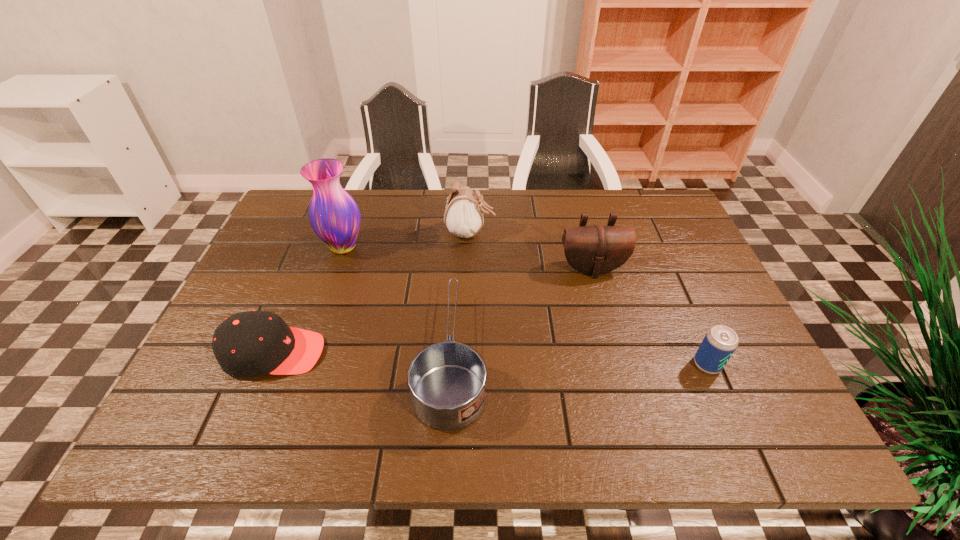
Identify the location of vacant area situated 0.130m on the front-facing side of the cap. The width and height of the screenshot is (960, 540). (383, 353).

You are a GUI agent. You are given a task and a screenshot of the screen. Output one action in this format:
    pyautogui.click(x=<x>, y=<y>)
    Task: Click on the free location located 0.300m on the back of the beer can
    The height and width of the screenshot is (540, 960).
    Given the screenshot: What is the action you would take?
    pyautogui.click(x=661, y=262)

Locate an element on the screen. The width and height of the screenshot is (960, 540). vacant position located 0.370m with the handle extending from one side of the saucepan is located at coordinates pyautogui.click(x=460, y=210).

What are the coordinates of `vacant area situated 0.380m with the handle extending from one side of the saucepan` in the screenshot? It's located at (460, 208).

Find the location of a particular element. The height and width of the screenshot is (540, 960). free space located with the handle extending from one side of the saucepan is located at coordinates (460, 214).

Find the location of a particular element. vase located in the far edge section of the desktop is located at coordinates (334, 216).

The width and height of the screenshot is (960, 540). I want to click on pouch at the far edge, so click(463, 217).

The width and height of the screenshot is (960, 540). I want to click on object that is at the near edge, so click(x=447, y=381).

This screenshot has height=540, width=960. In order to click on vase present at the left edge in this screenshot , I will do `click(334, 216)`.

Identify the location of cap at the left edge. (252, 343).